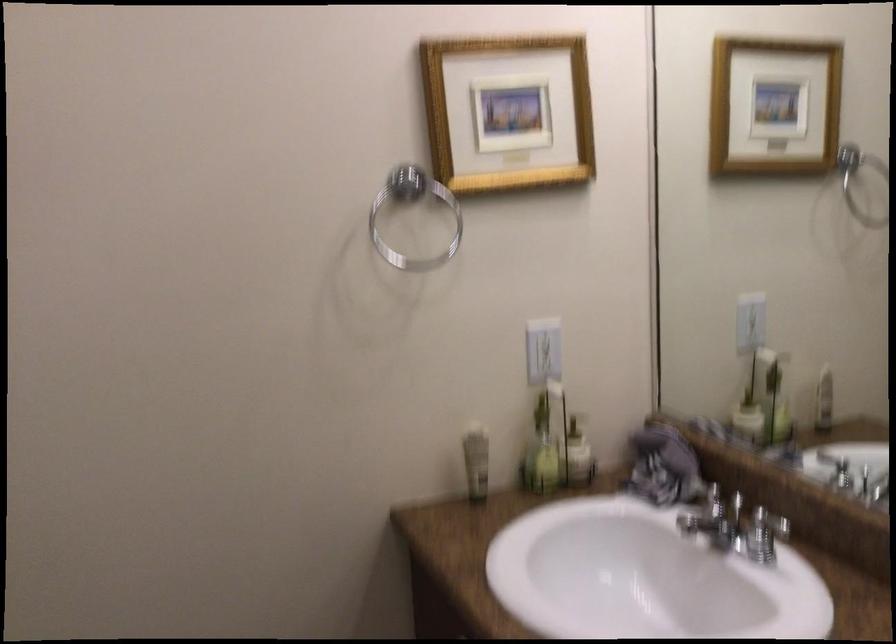
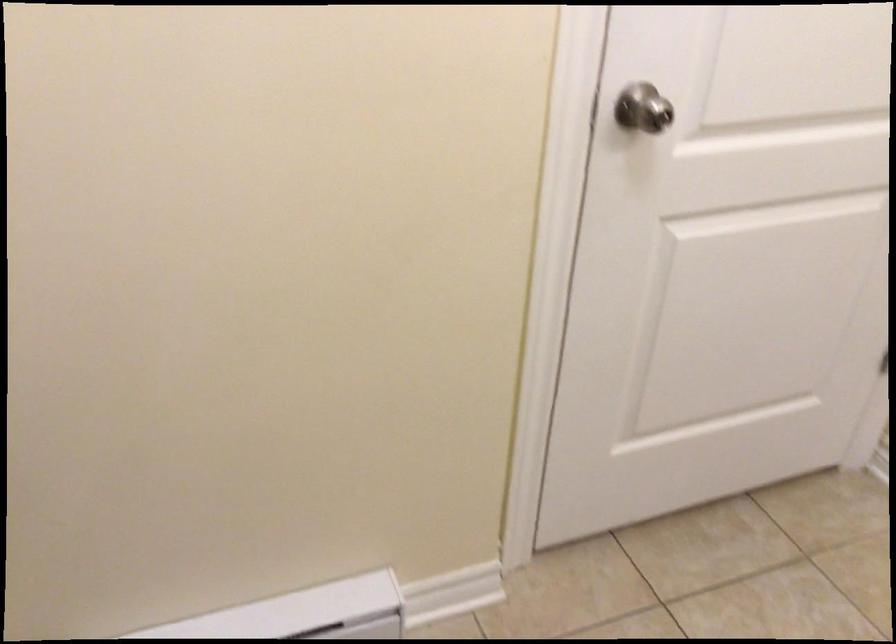
The first image is from the beginning of the video and the second image is from the end. How did the camera likely rotate when shooting the video?

The camera rotated toward left-down.